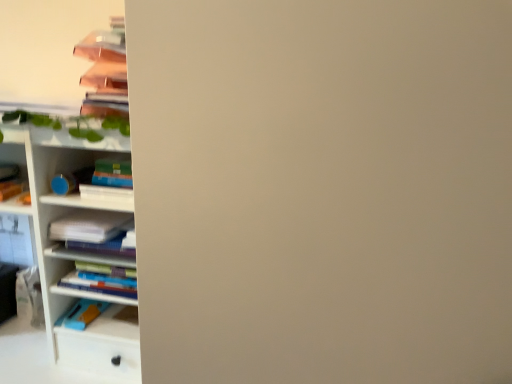
Question: Looking at their shapes, would you say white paper at left is wider or thinner than white glossy bookshelf at left?

Choices:
 (A) wide
 (B) thin

Answer: (A)

Question: From a real-world perspective, is white paper at left above or below white glossy bookshelf at left?

Choices:
 (A) below
 (B) above

Answer: (A)

Question: In terms of height, does white paper at left look taller or shorter compared to white glossy bookshelf at left?

Choices:
 (A) short
 (B) tall

Answer: (A)

Question: Considering their positions, is white glossy bookshelf at left located in front of or behind white paper at left?

Choices:
 (A) front
 (B) behind

Answer: (A)

Question: Is white glossy bookshelf at left inside the boundaries of white paper at left, or outside?

Choices:
 (A) inside
 (B) outside

Answer: (B)

Question: From the image's perspective, is white glossy bookshelf at left located above or below white paper at left?

Choices:
 (A) below
 (B) above

Answer: (B)

Question: From a real-world perspective, relative to white paper at left, is white glossy bookshelf at left vertically above or below?

Choices:
 (A) below
 (B) above

Answer: (B)